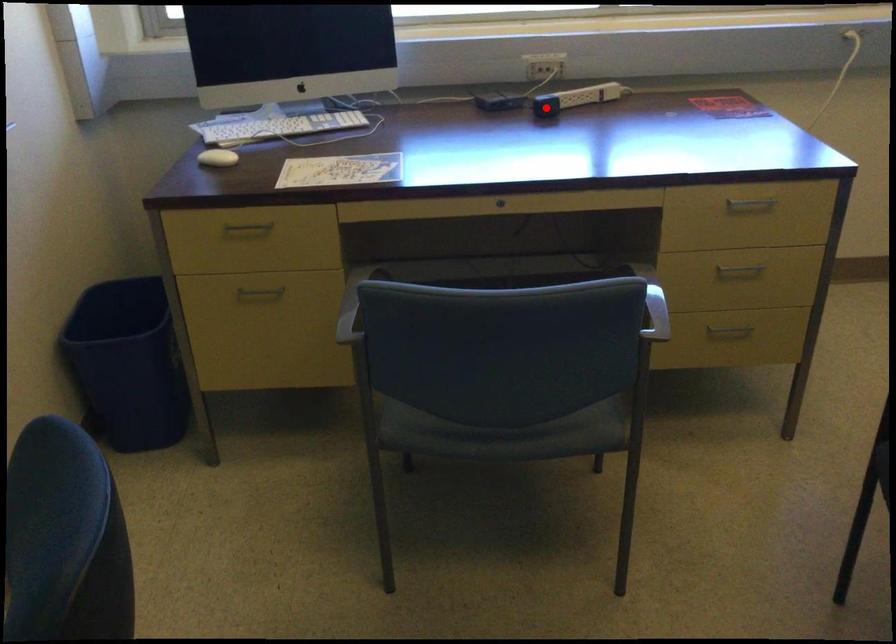
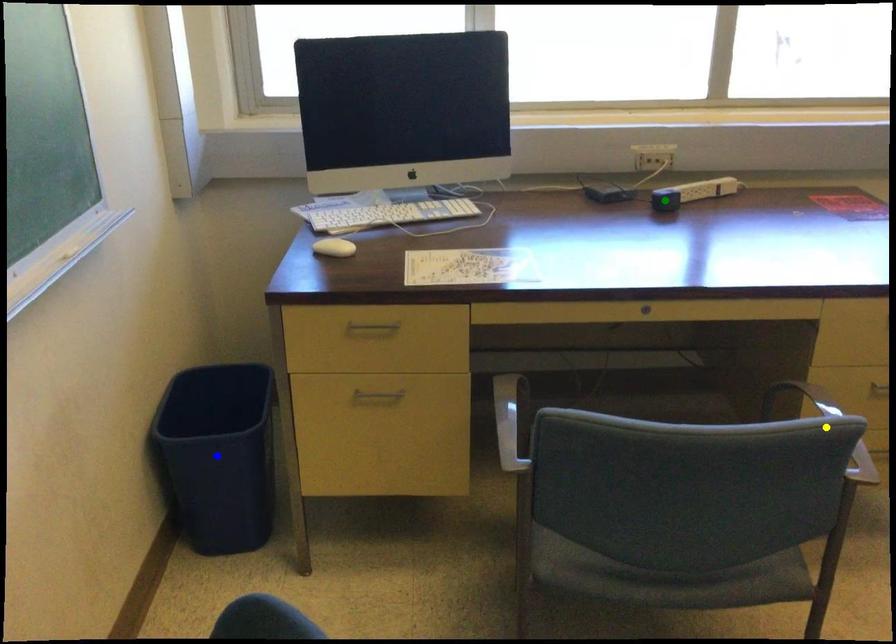
Question: I am providing you with two images of the same scene from different viewpoints. A red point is marked on the first image. You are given multiple points on the second image. Which point in image 2 represents the same 3d spot as the red point in image 1?

Choices:
 (A) green point
 (B) yellow point
 (C) blue point

Answer: (A)